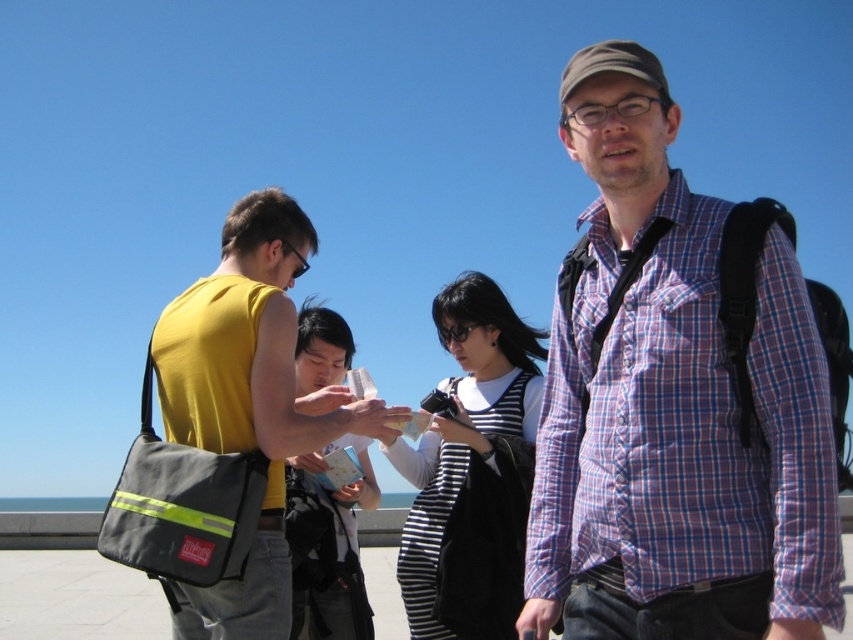
In the scene shown: Who is more distant from viewer, [256,444] or [329,605]?

The point [329,605] is more distant.

Locate an element on the screen. The height and width of the screenshot is (640, 853). yellow fabric tank top at left is located at coordinates (248, 401).

Is plaid cotton shirt at center positioned in front of striped fabric shirt at center?

Yes.

Which is in front, point (598, 410) or point (312, 385)?

Point (598, 410) is more forward.

You are a GUI agent. You are given a task and a screenshot of the screen. Output one action in this format:
    pyautogui.click(x=<x>, y=<y>)
    Task: Click on the plaid cotton shirt at center
    The image size is (853, 640).
    Given the screenshot: What is the action you would take?
    pyautogui.click(x=674, y=406)

Identify the location of plaid cotton shirt at center. (674, 406).

Is point (292, 348) in front of point (492, 301)?

That is True.

Is yellow fabric tank top at left bigger than striped fabric dress at center?

No.

Is point (274, 236) farther from viewer compared to point (444, 307)?

No, it is in front of (444, 307).

I want to click on yellow fabric tank top at left, so click(x=248, y=401).